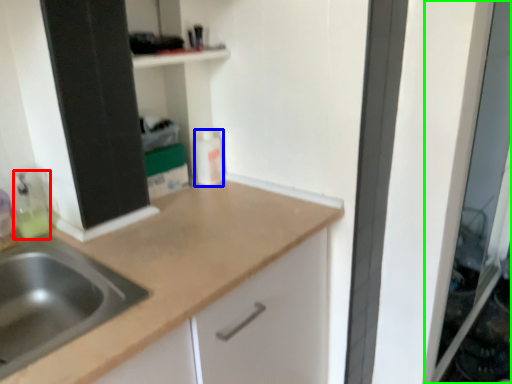
Question: Based on their relative distances, which object is farther from cleaning product (highlighted by a red box)? Choose from bottle (highlighted by a blue box) and screen door (highlighted by a green box).

Choices:
 (A) bottle
 (B) screen door

Answer: (B)